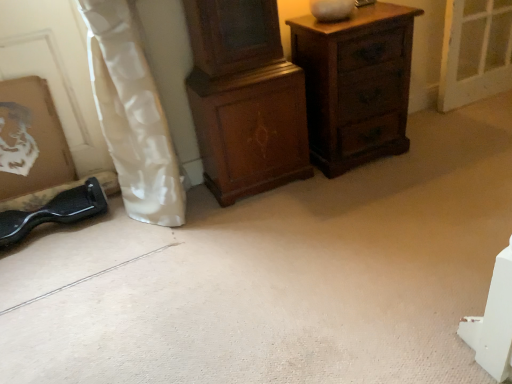
Question: Considering their positions, is wooden cabinet at center, positioned as the first chest of drawers in left-to-right order, located in front of or behind wooden picture frame at lower left?

Choices:
 (A) behind
 (B) front

Answer: (B)

Question: In terms of height, does wooden cabinet at center, which ranks as the 2th chest of drawers in right-to-left order, look taller or shorter compared to wooden picture frame at lower left?

Choices:
 (A) short
 (B) tall

Answer: (B)

Question: Estimate the real-world distances between objects in this image. Which object is closer to the white glossy curtain at left?

Choices:
 (A) wooden chest of drawers at upper right, the first chest of drawers in the right-to-left sequence
 (B) wooden picture frame at lower left
 (C) wooden cabinet at center, positioned as the first chest of drawers in left-to-right order

Answer: (C)

Question: Considering the real-world distances, which object is closest to the wooden chest of drawers at upper right, the first chest of drawers in the right-to-left sequence?

Choices:
 (A) white glossy curtain at left
 (B) wooden picture frame at lower left
 (C) wooden cabinet at center, positioned as the first chest of drawers in left-to-right order

Answer: (C)